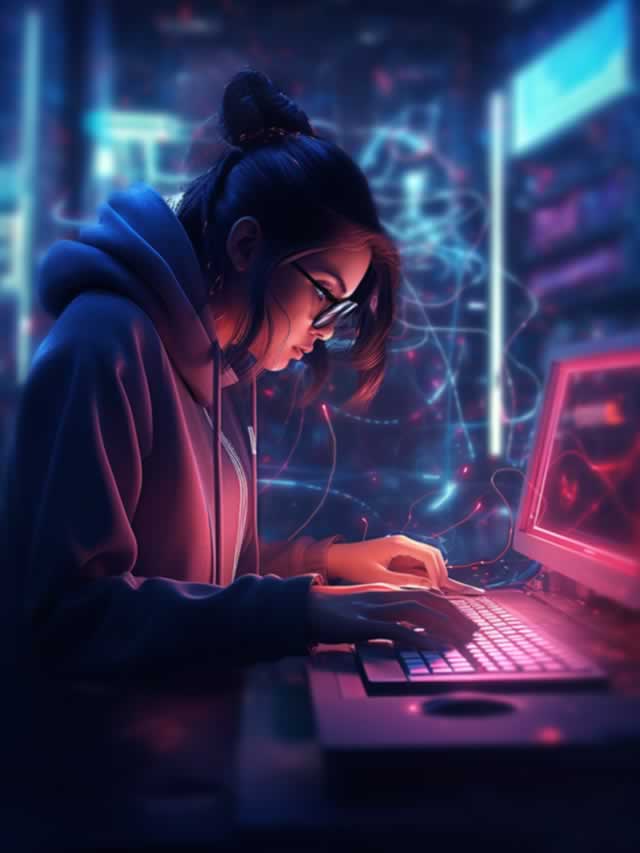
Locate an element on the screen. computer monitor is located at coordinates (598, 476).